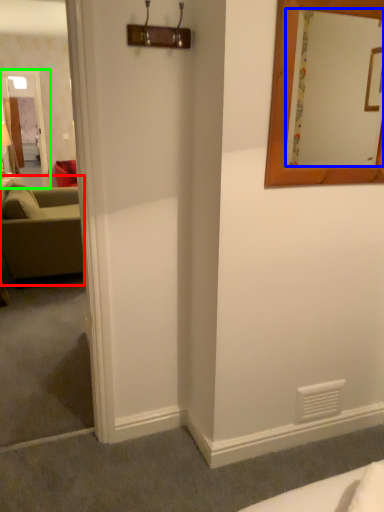
Question: Which is nearer to the studio couch (highlighted by a red box)? mirror (highlighted by a blue box) or glass door (highlighted by a green box).

Choices:
 (A) mirror
 (B) glass door

Answer: (A)